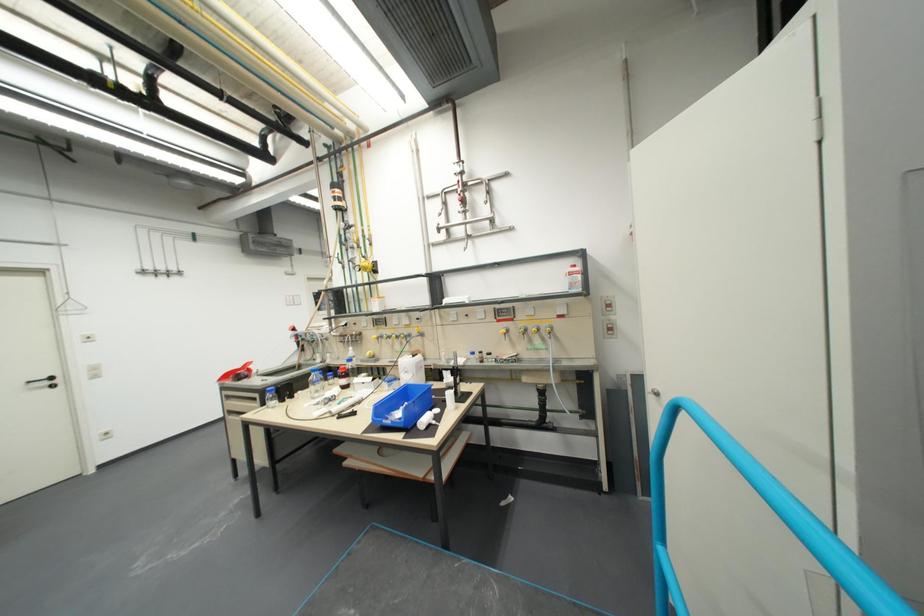
Find the location of a particular element. wire coat hanger is located at coordinates (70, 306).